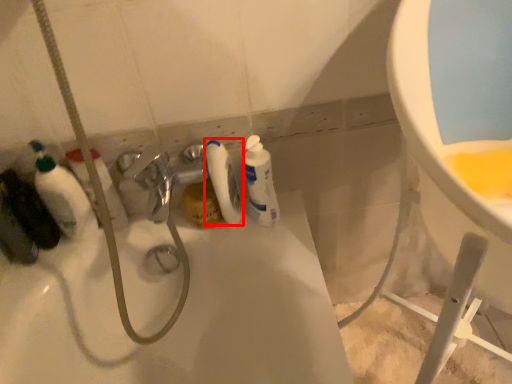
Question: From the image, what is the correct spatial relationship of cleaning product (annotated by the red box) in relation to cleaning product?

Choices:
 (A) right
 (B) left

Answer: (B)